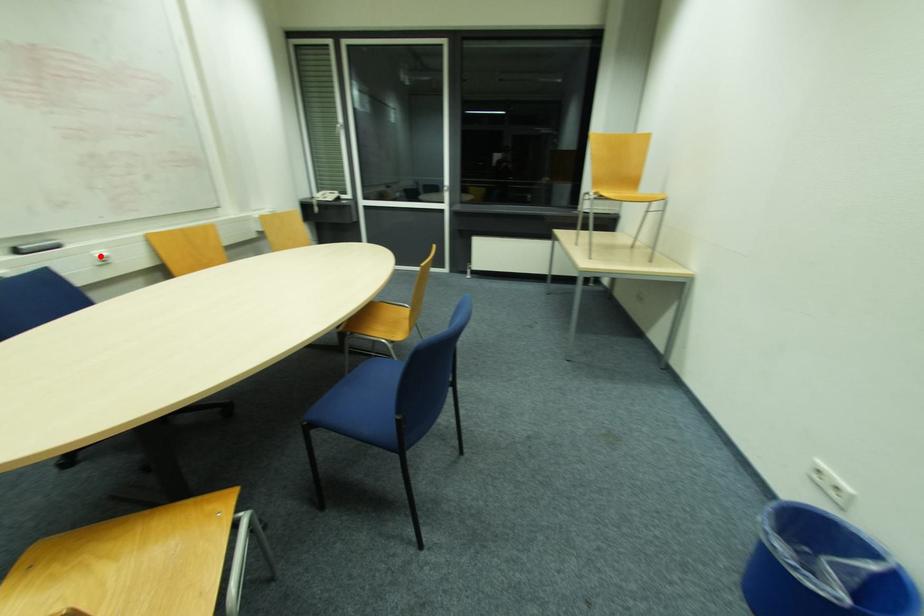
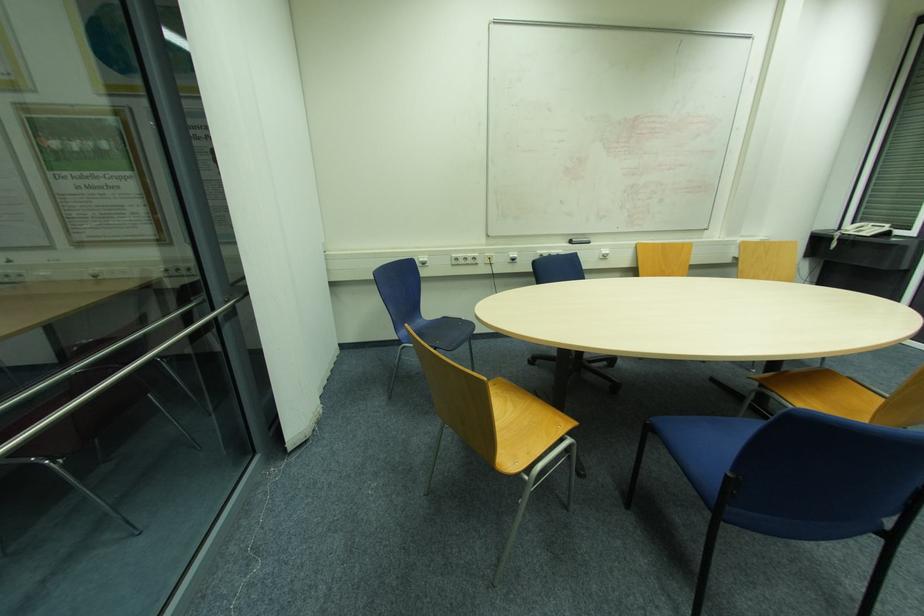
Where in the second image is the point corresponding to the highlighted location from the first image?

(604, 253)